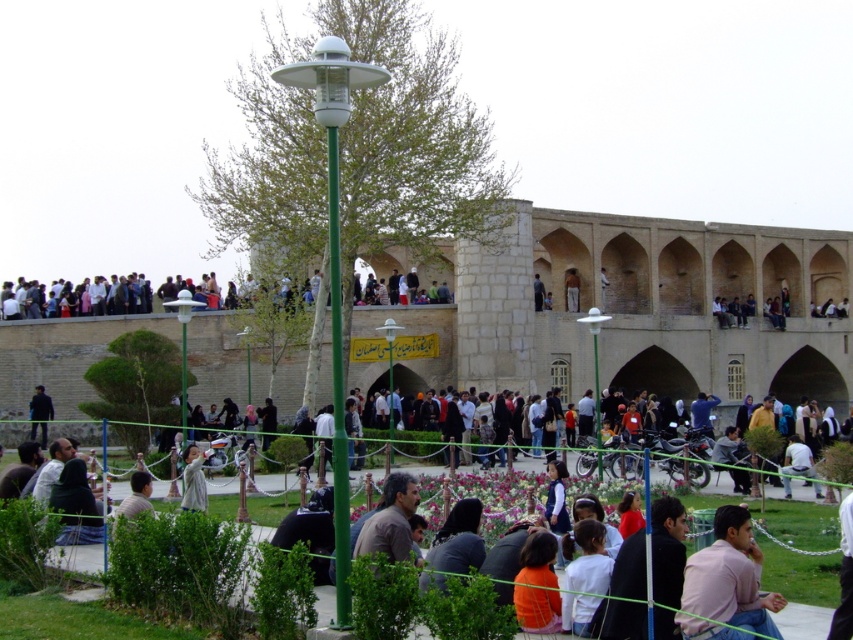
Question: Is multicolored clothing at upper center positioned at the back of light brown wooden pole at upper center?

Choices:
 (A) no
 (B) yes

Answer: (A)

Question: Is pink cotton shirt at lower right to the left of light brown wooden pole at upper center from the viewer's perspective?

Choices:
 (A) yes
 (B) no

Answer: (A)

Question: Which of the following is the closest to the observer?

Choices:
 (A) light brown wooden pole at upper center
 (B) light brown leather jacket at upper center
 (C) pink cotton shirt at lower right

Answer: (C)

Question: Is the position of pink cotton shirt at lower right less distant than that of light brown leather jacket at upper center?

Choices:
 (A) yes
 (B) no

Answer: (A)

Question: Estimate the real-world distances between objects in this image. Which object is farther from the light brown leather jacket at upper center?

Choices:
 (A) light brown wooden pole at upper center
 (B) multicolored clothing at upper center
 (C) pink cotton shirt at lower right

Answer: (C)

Question: Among these objects, which one is nearest to the camera?

Choices:
 (A) light brown leather jacket at upper center
 (B) pink cotton shirt at lower right

Answer: (B)